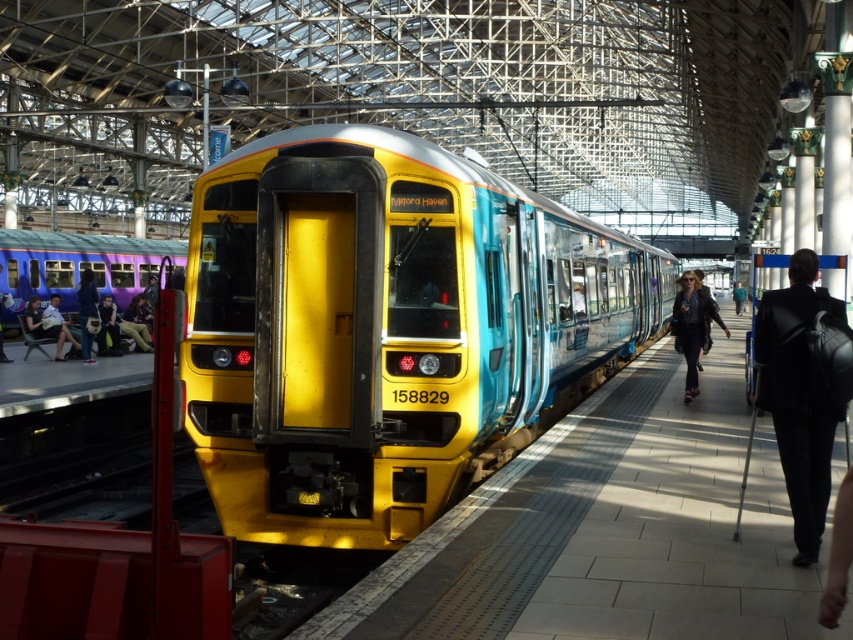
Question: Observing the image, what is the correct spatial positioning of leather jacket at center in reference to denim jacket at left?

Choices:
 (A) right
 (B) left

Answer: (A)

Question: Which point appears farthest from the camera in this image?

Choices:
 (A) (62, 358)
 (B) (700, 348)

Answer: (A)

Question: Can you confirm if matte purple train at left is wider than leather jacket at center?

Choices:
 (A) no
 (B) yes

Answer: (A)

Question: Which of these objects is positioned closest to the matte black jacket at left?

Choices:
 (A) yellow matte train at center
 (B) matte purple train at left

Answer: (B)

Question: Which object is positioned closest to the leather jacket at center?

Choices:
 (A) dark suit at right
 (B) matte black jacket at left
 (C) matte purple train at left

Answer: (A)

Question: Is matte purple train at left to the right of leather jacket at center from the viewer's perspective?

Choices:
 (A) yes
 (B) no

Answer: (B)